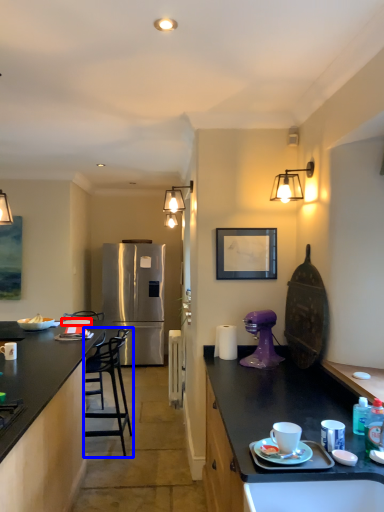
Question: Which object is closer to the camera taking this photo, tableware (highlighted by a red box) or chair (highlighted by a blue box)?

Choices:
 (A) tableware
 (B) chair

Answer: (B)